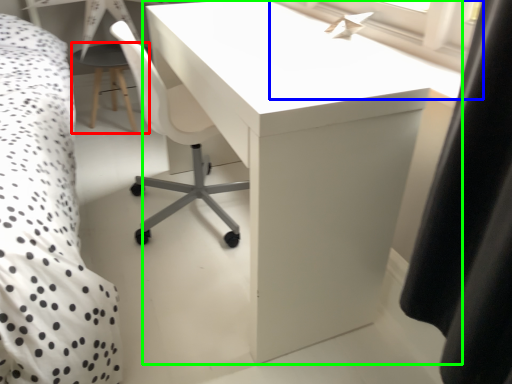
Question: Considering the real-world distances, which object is farthest from side table (highlighted by a red box)? window screen (highlighted by a blue box) or table (highlighted by a green box)?

Choices:
 (A) window screen
 (B) table

Answer: (A)